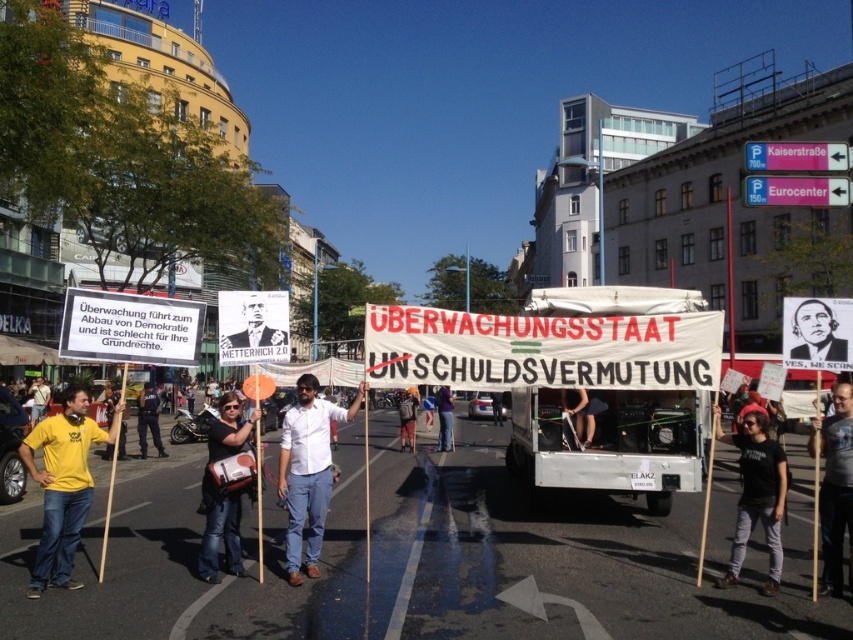
Question: Does denim jacket at center have a lesser width compared to yellow fabric shirt at lower left?

Choices:
 (A) no
 (B) yes

Answer: (B)

Question: Which object is farther from the camera taking this photo?

Choices:
 (A) denim jacket at center
 (B) dark blue jeans at center

Answer: (B)

Question: Is denim jacket at center to the left of yellow shirt at center from the viewer's perspective?

Choices:
 (A) no
 (B) yes

Answer: (A)

Question: Does yellow t-shirt at left have a larger size compared to dark blue jeans at center?

Choices:
 (A) yes
 (B) no

Answer: (A)

Question: Which of the following is the closest to the observer?

Choices:
 (A) (840, 384)
 (B) (250, 344)
 (C) (57, 472)

Answer: (C)

Question: Which object appears farthest from the camera in this image?

Choices:
 (A) dark blue jeans at center
 (B) yellow shirt at center
 (C) gray cotton shirt at center
 (D) white matte shirt at center

Answer: (A)